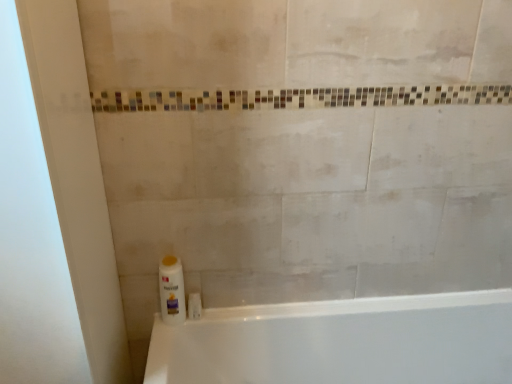
Where is `white glossy bathtub at lower left`? The height and width of the screenshot is (384, 512). white glossy bathtub at lower left is located at coordinates tap(342, 342).

Where is `white glossy bottle at lower left`? The width and height of the screenshot is (512, 384). white glossy bottle at lower left is located at coordinates (172, 290).

Are white glossy screen door at left and white glossy bottle at lower left located far from each other?

white glossy screen door at left is actually quite close to white glossy bottle at lower left.

This screenshot has width=512, height=384. I want to click on cleaning product located on the right of white glossy screen door at left, so click(x=172, y=290).

How different are the orientations of white glossy screen door at left and white glossy bottle at lower left in degrees?

0.0541 degrees separate the facing orientations of white glossy screen door at left and white glossy bottle at lower left.

Looking at this image, from the image's perspective, is white glossy screen door at left on top of white glossy bottle at lower left?

Yes, from the image's perspective, white glossy screen door at left is on top of white glossy bottle at lower left.

Can you confirm if white glossy bathtub at lower left is wider than white glossy screen door at left?

Yes.

Which is less distant, (486, 335) or (32, 133)?

Clearly, point (486, 335) is more distant from the camera than point (32, 133).

Looking at this image, considering the sizes of objects white glossy bathtub at lower left and white glossy screen door at left in the image provided, who is shorter, white glossy bathtub at lower left or white glossy screen door at left?

white glossy bathtub at lower left.

From the image's perspective, is white glossy bottle at lower left located beneath white glossy bathtub at lower left?

No, from the image's perspective, white glossy bottle at lower left is not beneath white glossy bathtub at lower left.

How many degrees apart are the facing directions of white glossy bottle at lower left and white glossy bathtub at lower left?

The angular difference between white glossy bottle at lower left and white glossy bathtub at lower left is 0.923 degrees.

Looking at this image, which object is wider, white glossy bottle at lower left or white glossy bathtub at lower left?

With larger width is white glossy bathtub at lower left.

Can you see white glossy bottle at lower left touching white glossy bathtub at lower left?

No, white glossy bottle at lower left is not making contact with white glossy bathtub at lower left.

From the image's perspective, which object appears higher, white glossy bottle at lower left or white glossy screen door at left?

From the image's view, white glossy screen door at left is above.

Which object is positioned more to the right, white glossy bottle at lower left or white glossy screen door at left?

Positioned to the right is white glossy bottle at lower left.

From a real-world perspective, is white glossy bottle at lower left above or below white glossy screen door at left?

From a real-world perspective, white glossy bottle at lower left is physically below white glossy screen door at left.

Is white glossy bottle at lower left beside white glossy screen door at left?

They are not placed beside each other.

Is white glossy bathtub at lower left closer to camera compared to white glossy bottle at lower left?

Yes, the depth of white glossy bathtub at lower left is less than that of white glossy bottle at lower left.

From a real-world perspective, which object stands above the other?

white glossy bottle at lower left, from a real-world perspective.

Is white glossy bathtub at lower left not inside white glossy bottle at lower left?

white glossy bathtub at lower left is positioned outside white glossy bottle at lower left.

From the image's perspective, which object appears higher, white glossy bathtub at lower left or white glossy bottle at lower left?

white glossy bottle at lower left appears higher in the image.

Could you tell me if white glossy screen door at left is turned towards white glossy bathtub at lower left?

No.

From the picture: Can we say white glossy screen door at left lies outside white glossy bathtub at lower left?

Yes, white glossy screen door at left is outside of white glossy bathtub at lower left.

Does white glossy screen door at left come behind white glossy bathtub at lower left?

No, white glossy screen door at left is closer to the viewer.

Is white glossy screen door at left wider than white glossy bathtub at lower left?

No, white glossy screen door at left is not wider than white glossy bathtub at lower left.

Where is `cleaning product below the white glossy screen door at left (from the image's perspective)`? The height and width of the screenshot is (384, 512). cleaning product below the white glossy screen door at left (from the image's perspective) is located at coordinates (172, 290).

Where is `screen door on the left of white glossy bathtub at lower left`? The image size is (512, 384). screen door on the left of white glossy bathtub at lower left is located at coordinates (31, 238).

Estimate the real-world distances between objects in this image. Which object is further from white glossy bathtub at lower left, white glossy screen door at left or white glossy bottle at lower left?

Based on the image, white glossy screen door at left appears to be further to white glossy bathtub at lower left.

From the image, which object appears to be nearer to white glossy screen door at left, white glossy bathtub at lower left or white glossy bottle at lower left?

white glossy bottle at lower left lies closer to white glossy screen door at left than the other object.

Which object lies further to the anchor point white glossy bottle at lower left, white glossy bathtub at lower left or white glossy screen door at left?

white glossy bathtub at lower left.

Estimate the real-world distances between objects in this image. Which object is further from white glossy bathtub at lower left, white glossy bottle at lower left or white glossy screen door at left?

Among the two, white glossy screen door at left is located further to white glossy bathtub at lower left.

Estimate the real-world distances between objects in this image. Which object is closer to white glossy bottle at lower left, white glossy screen door at left or white glossy bathtub at lower left?

white glossy screen door at left is closer to white glossy bottle at lower left.

When comparing their distances from white glossy screen door at left, does white glossy bottle at lower left or white glossy bathtub at lower left seem closer?

white glossy bottle at lower left is closer to white glossy screen door at left.

You are a GUI agent. You are given a task and a screenshot of the screen. Output one action in this format:
    pyautogui.click(x=<x>, y=<y>)
    Task: Click on the cleaning product situated between white glossy screen door at left and white glossy bathtub at lower left from left to right
    Image resolution: width=512 pixels, height=384 pixels.
    Given the screenshot: What is the action you would take?
    pyautogui.click(x=172, y=290)